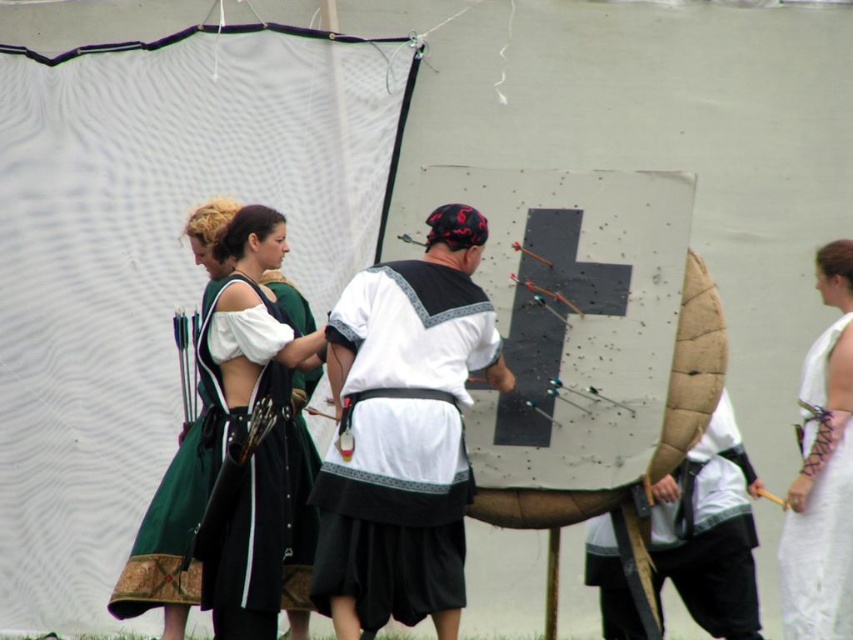
You are an event organizer planning to rearrange the medieval archery display. You need to place a new decorative banner to the right of the white lace cloth at right. Where should you position the banner relative to the brown leather shield at center?

The brown leather shield at center is to the left of the white lace cloth at right. Therefore, placing the new decorative banner to the right of the white lace cloth at right would position it to the right of the brown leather shield at center as well.

You are a photographer positioned at the camera location. You want to capture a closeup of the white cotton shirt at center. Given that your camera has a maximum zoom range of 50 meters, will you be able to achieve this?

The white cotton shirt at center is 50.21 meters away from the camera. Since the camera can only zoom up to 50 meters, it will not be sufficient to capture a closeup of the white cotton shirt at center.

You are a costume designer preparing for a medieval play. You have two items from the scene described above. The first is the white cotton shirt at center, and the second is the white lace cloth at right. Which of these two items is bigger in size?

The white cotton shirt at center is larger in size compared to the white lace cloth at right.